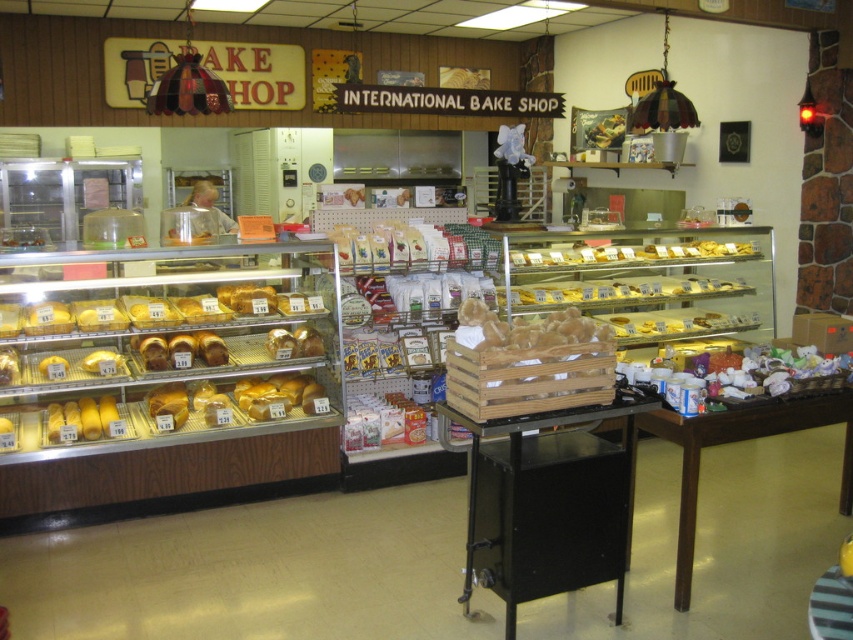
Is black metal table at center positioned in front of brown wooden table at lower right?

Yes, black metal table at center is closer to the viewer.

Which is more to the left, black metal table at center or brown wooden table at lower right?

black metal table at center is more to the left.

Who is more distant from viewer, (572,417) or (641,428)?

The point (641,428) is more distant.

Identify the location of black metal table at center. (548, 502).